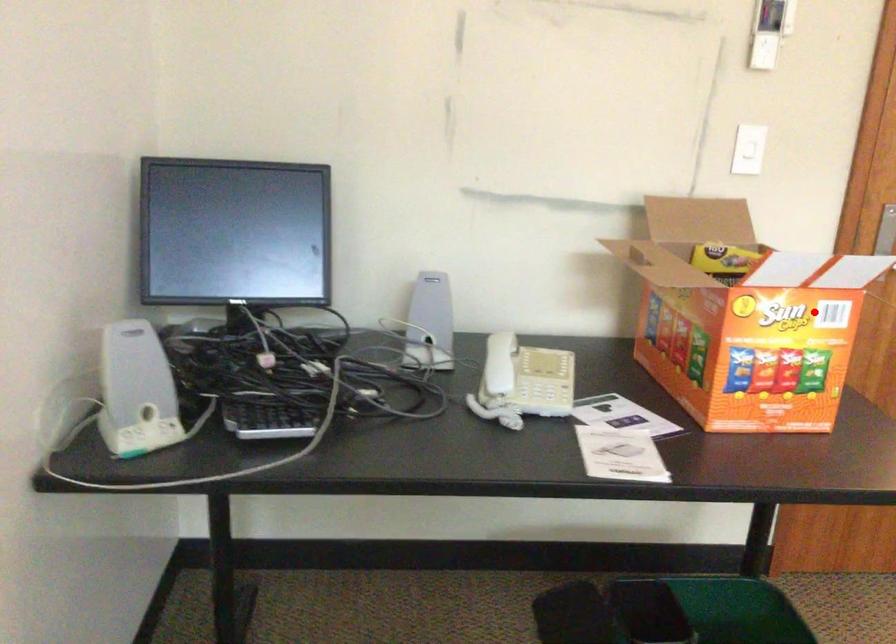
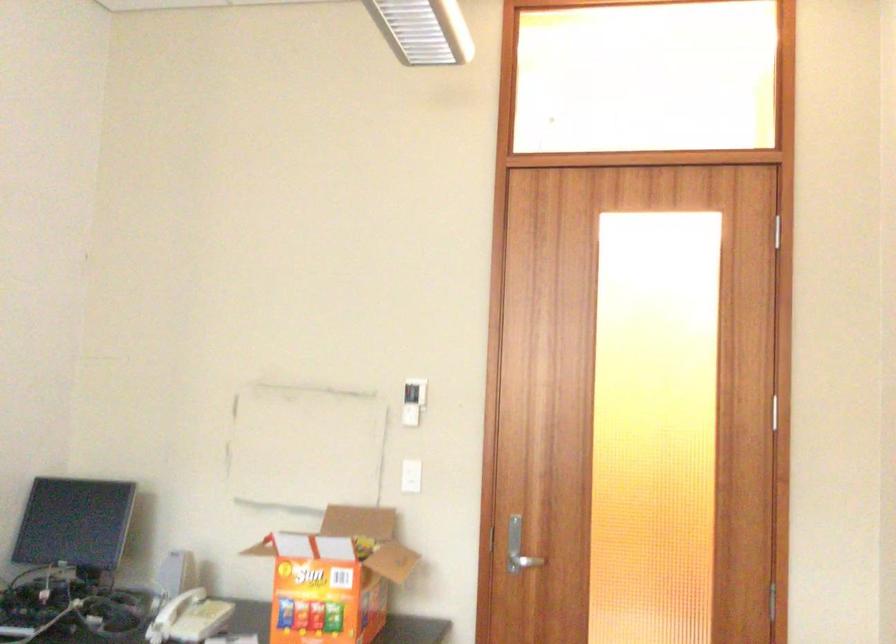
Question: I am providing you with two images of the same scene from different viewpoints. Image1 has a red point marked. In image2, the corresponding 3D location appears at what relative position? Reply with the corresponding letter.

Choices:
 (A) Closer
 (B) Farther

Answer: (B)